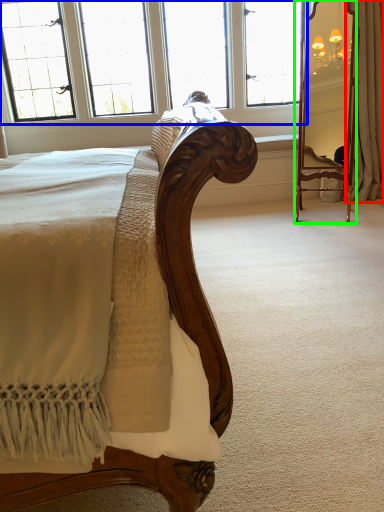
Question: Estimate the real-world distances between objects in this image. Which object is farther from curtain (highlighted by a red box), window (highlighted by a blue box) or mirror (highlighted by a green box)?

Choices:
 (A) window
 (B) mirror

Answer: (A)